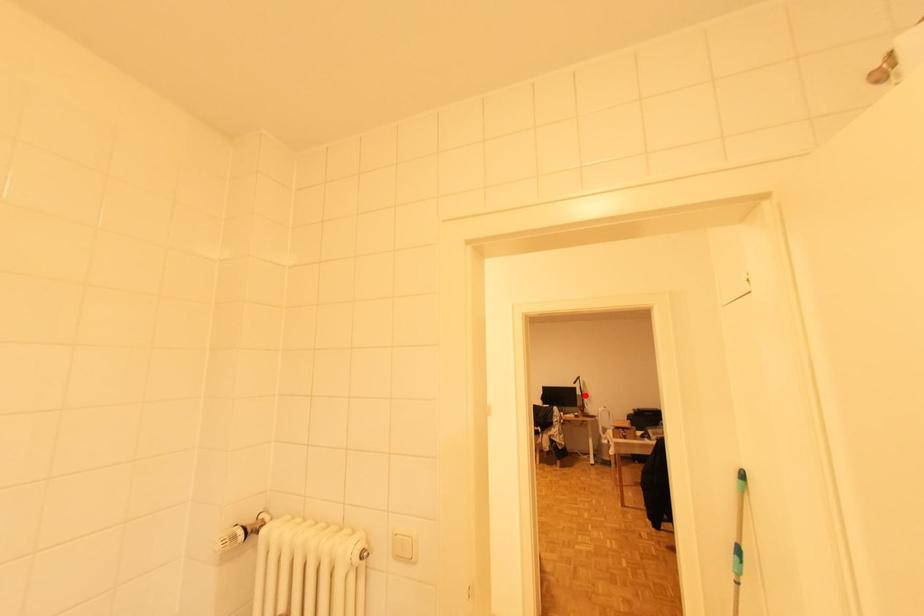
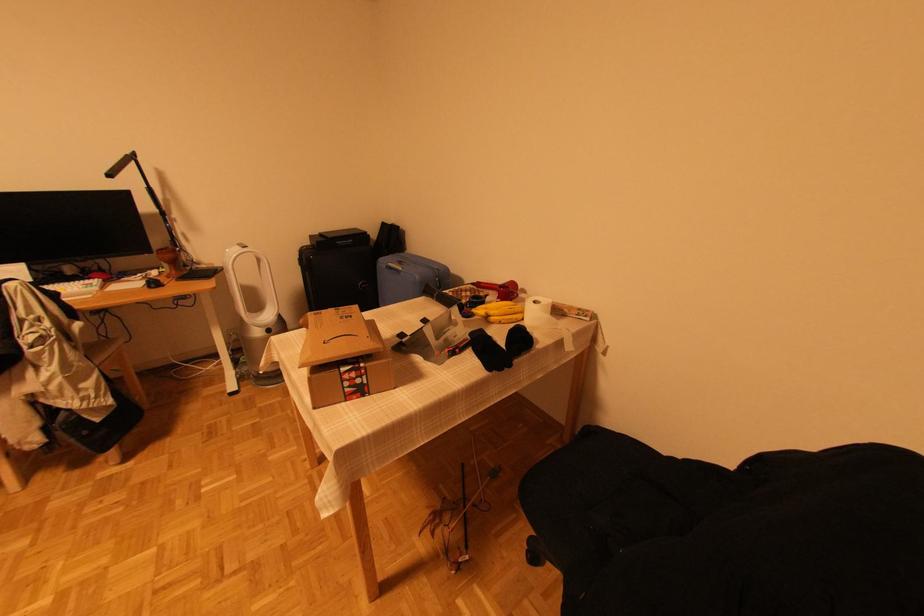
Question: I am providing you with two images of the same scene from different viewpoints. In image1, a red point is highlighted. Considering the same 3D point in image2, which of the following is correct?

Choices:
 (A) It is closer
 (B) It is farther

Answer: (A)